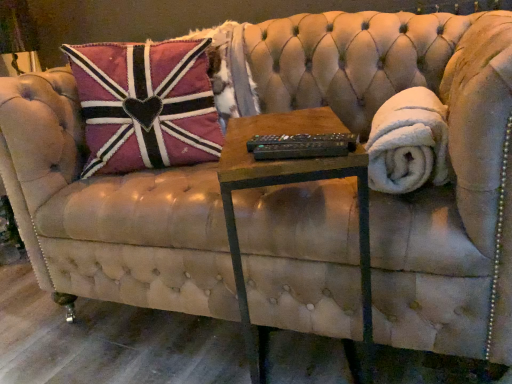
Locate an element on the screen. vacant position to the left of woodenmaterial/texturetable at center is located at coordinates (204, 354).